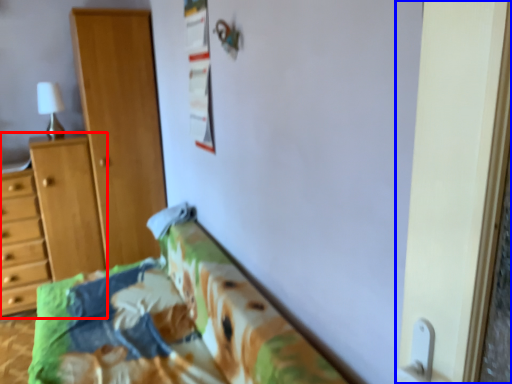
Question: Which of the following is the closest to the observer, vanity (highlighted by a red box) or screen door (highlighted by a blue box)?

Choices:
 (A) vanity
 (B) screen door

Answer: (B)